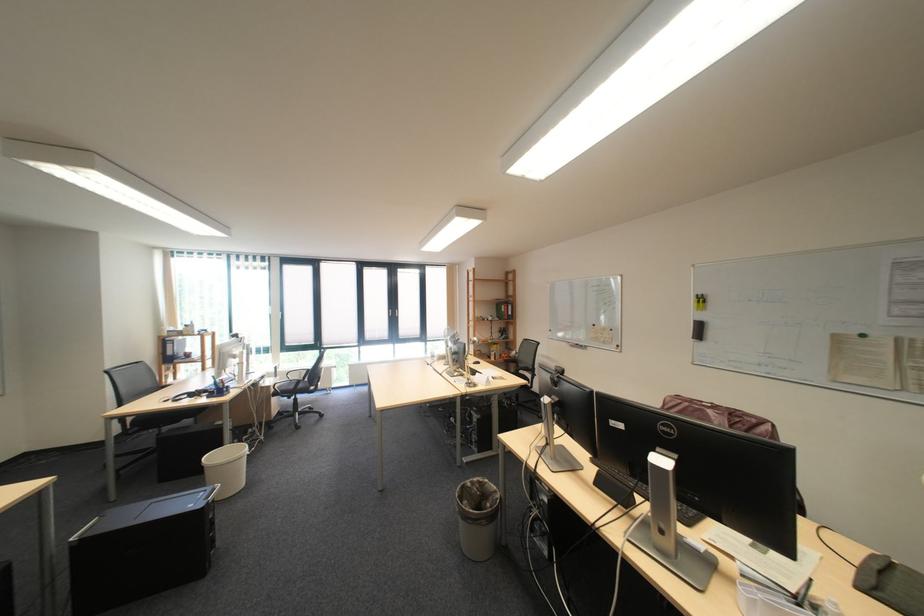
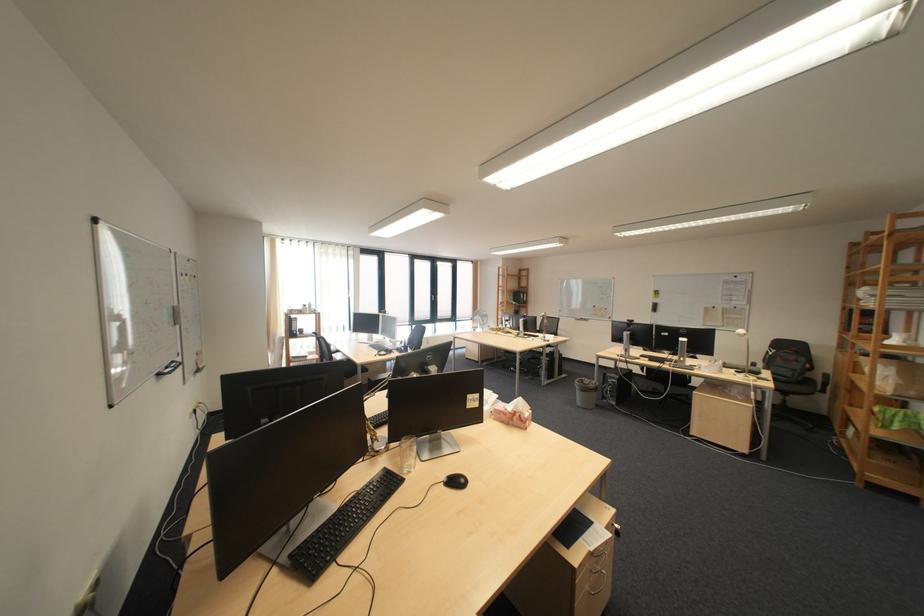
In the second image, find the point that corresponds to (x=609, y=326) in the first image.

(609, 308)